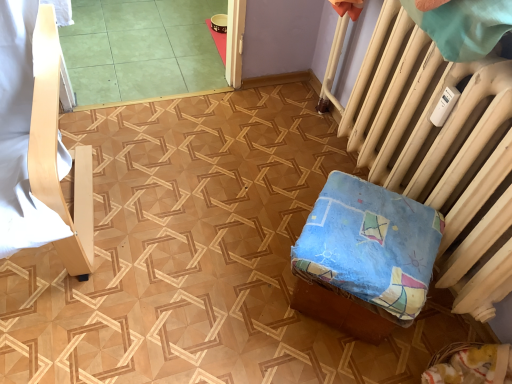
Question: Would you consider white painted radiator at right to be distant from light wood chair at left, the first furniture viewed from the left?

Choices:
 (A) no
 (B) yes

Answer: (A)

Question: Does white painted radiator at right contain light wood chair at left, which is the second furniture from right to left?

Choices:
 (A) yes
 (B) no

Answer: (B)

Question: Does white painted radiator at right have a lesser width compared to light wood chair at left, the first furniture viewed from the left?

Choices:
 (A) no
 (B) yes

Answer: (B)

Question: From a real-world perspective, is white painted radiator at right on top of light wood chair at left, the first furniture viewed from the left?

Choices:
 (A) yes
 (B) no

Answer: (B)

Question: Is white painted radiator at right positioned beyond the bounds of light wood chair at left, the first furniture viewed from the left?

Choices:
 (A) yes
 (B) no

Answer: (A)

Question: In terms of height, does green tile at upper left look taller or shorter compared to white painted radiator at right?

Choices:
 (A) tall
 (B) short

Answer: (B)

Question: Would you say green tile at upper left is inside or outside white painted radiator at right?

Choices:
 (A) inside
 (B) outside

Answer: (B)

Question: In the image, is green tile at upper left on the left side or the right side of white painted radiator at right?

Choices:
 (A) left
 (B) right

Answer: (A)

Question: From a real-world perspective, relative to white painted radiator at right, is green tile at upper left vertically above or below?

Choices:
 (A) below
 (B) above

Answer: (A)

Question: Is blue fabric cushion at lower right, which appears as the first furniture when viewed from the right, spatially inside light wood chair at left, which is the second furniture from right to left, or outside of it?

Choices:
 (A) inside
 (B) outside

Answer: (B)

Question: In terms of height, does blue fabric cushion at lower right, marked as the second furniture in a left-to-right arrangement, look taller or shorter compared to light wood chair at left, the first furniture viewed from the left?

Choices:
 (A) short
 (B) tall

Answer: (A)

Question: From the image's perspective, is blue fabric cushion at lower right, which appears as the first furniture when viewed from the right, located above or below light wood chair at left, the first furniture viewed from the left?

Choices:
 (A) below
 (B) above

Answer: (A)

Question: In terms of size, does blue fabric cushion at lower right, marked as the second furniture in a left-to-right arrangement, appear bigger or smaller than light wood chair at left, the first furniture viewed from the left?

Choices:
 (A) small
 (B) big

Answer: (A)

Question: Looking at the image, does blue fabric cushion at lower right, marked as the second furniture in a left-to-right arrangement, seem bigger or smaller compared to white painted radiator at right?

Choices:
 (A) small
 (B) big

Answer: (A)

Question: Is blue fabric cushion at lower right, marked as the second furniture in a left-to-right arrangement, in front of or behind white painted radiator at right in the image?

Choices:
 (A) front
 (B) behind

Answer: (B)